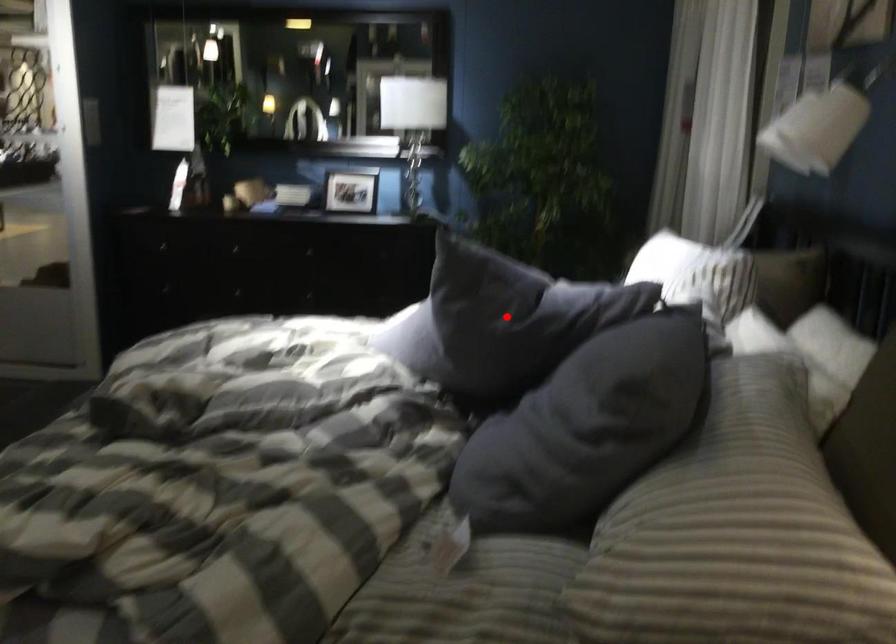
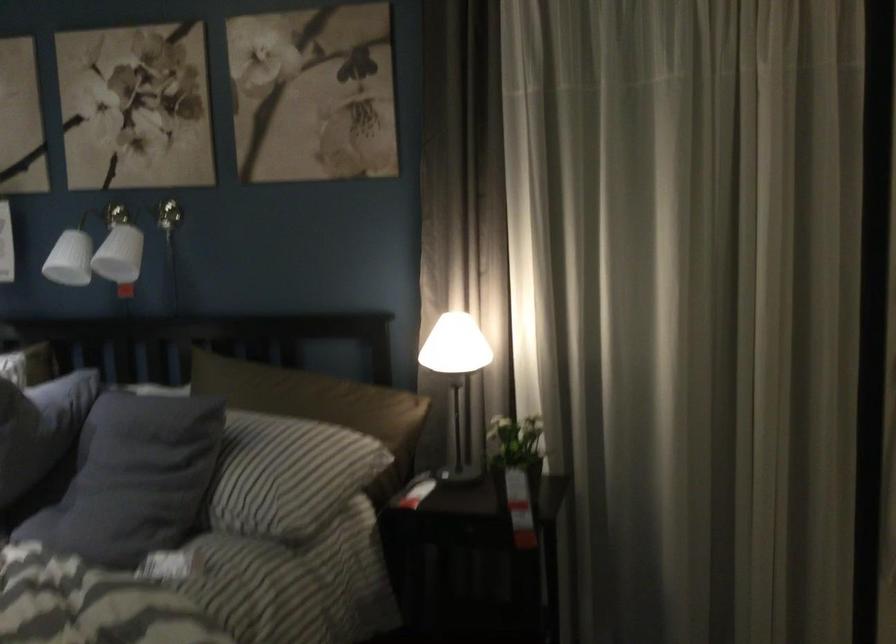
Question: I am providing you with two images of the same scene from different viewpoints. Given a red point in image1, look at the same physical point in image2. Is it:

Choices:
 (A) Closer to the viewpoint
 (B) Farther from the viewpoint

Answer: (B)